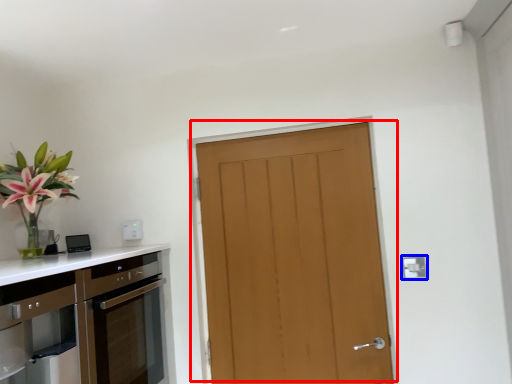
Question: Which object is further to the camera taking this photo, door (highlighted by a red box) or electric outlet (highlighted by a blue box)?

Choices:
 (A) door
 (B) electric outlet

Answer: (A)